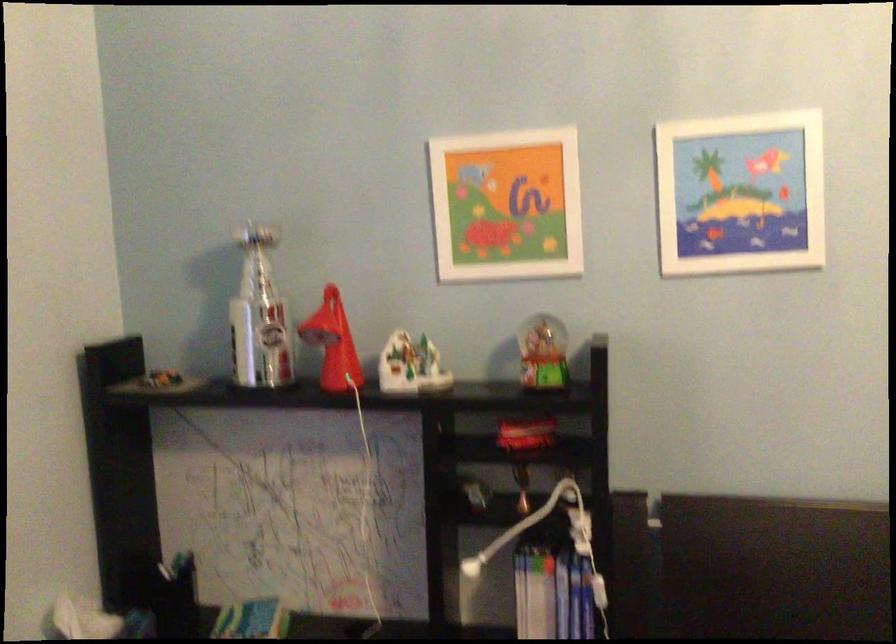
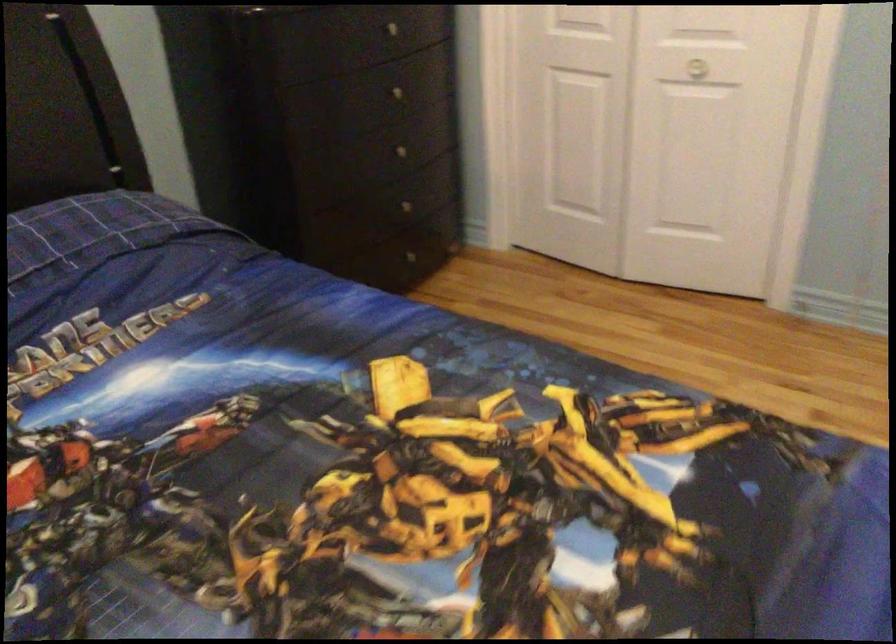
The images are taken continuously from a first-person perspective. In which direction is your viewpoint rotating?

The rotation direction of the camera is right-down.